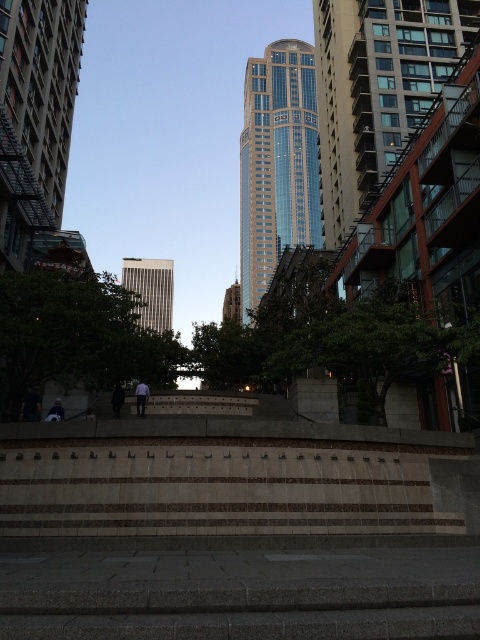
Question: Which point is closer to the camera taking this photo?

Choices:
 (A) (135, 404)
 (B) (231, 284)
 (C) (264, 266)
 (D) (58, 417)

Answer: (D)

Question: Is glassy steel skyscraper at center in front of shiny glass skyscraper at center?

Choices:
 (A) no
 (B) yes

Answer: (B)

Question: Based on their relative distances, which object is nearer to the light gray fabric jacket at lower left?

Choices:
 (A) glassy steel skyscraper at center
 (B) dark blue fabric at center

Answer: (B)

Question: Which point is closer to the camera taking this photo?

Choices:
 (A) (120, 384)
 (B) (135, 396)

Answer: (B)

Question: Can you confirm if glassy steel skyscraper at center is smaller than light brown leather jacket at center?

Choices:
 (A) yes
 (B) no

Answer: (B)

Question: Can you confirm if light brown leather jacket at center is wider than light gray fabric jacket at lower left?

Choices:
 (A) no
 (B) yes

Answer: (A)